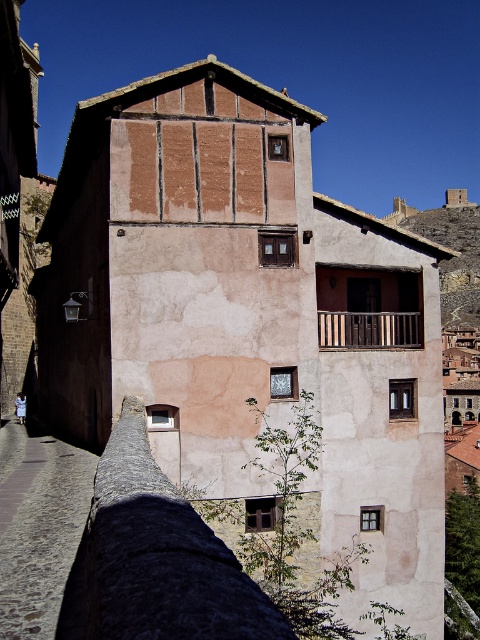
You are standing in front of a traditional building with a cobblestone alley nearby. There is a point marked at coordinates (38, 525). Based on the scene description, where is this point located?

The point at coordinates (38, 525) is on the cobblestone alley at lower left.

You are standing in front of the building and notice the cobblestone alley at lower left and the wooden at center. Which of these two features is taller?

The wooden at center is taller than the cobblestone alley at lower left.

You are standing 120 feet away from a traditional, multi story building with a rustic architectural style. You notice a point marked at coordinates point (3,440). Can you determine if you are closer to this point than 120 feet?

The point (3,440) is 123.05 feet from the viewer, so you are farther away than 120 feet.